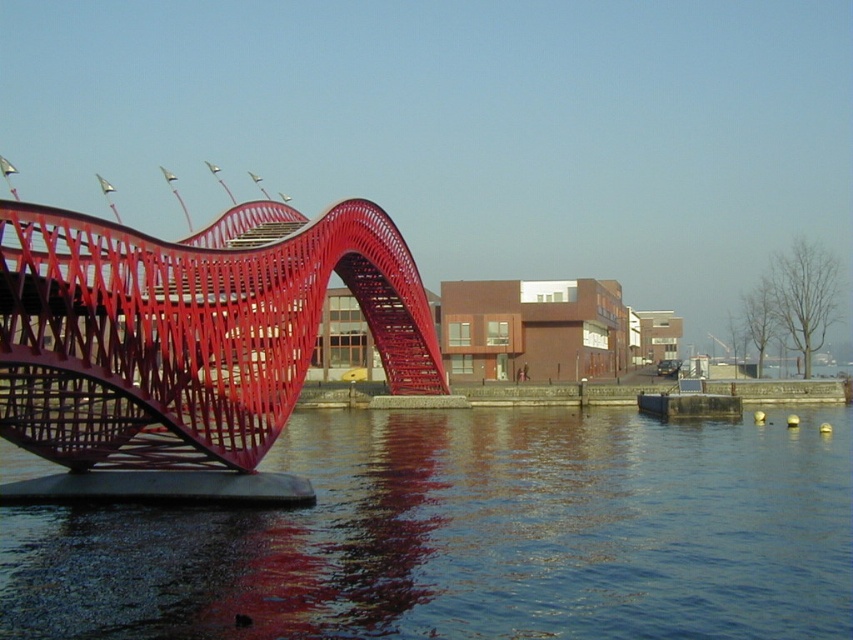
Question: Which object appears closest to the camera in this image?

Choices:
 (A) glossy water at lower left
 (B) metallic red bridge at left

Answer: (A)

Question: Does glossy water at lower left appear under metallic red bridge at left?

Choices:
 (A) yes
 (B) no

Answer: (A)

Question: Observing the image, what is the correct spatial positioning of glossy water at lower left in reference to metallic red bridge at left?

Choices:
 (A) left
 (B) right

Answer: (B)

Question: Can you confirm if glossy water at lower left is smaller than metallic red bridge at left?

Choices:
 (A) yes
 (B) no

Answer: (A)